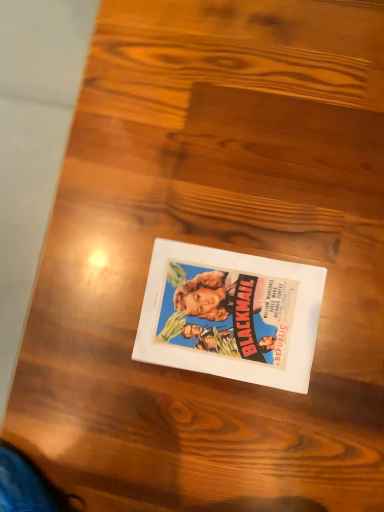
At what (x,y) coordinates should I click in order to perform the action: click on vacant space situated on the left part of matte paper book at center. Please return your answer as a coordinate pair (x, y). The image size is (384, 512). Looking at the image, I should click on (124, 396).